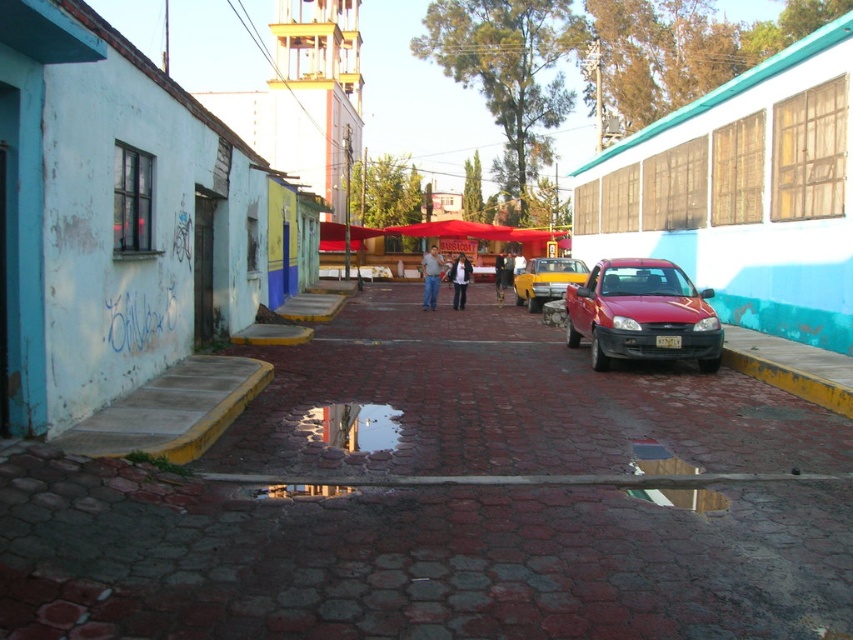
You are standing on the cobblestone street in the scene and want to cross to the building with light blue walls on the left. There is a glossy red car at center in your path. Can you safely walk around the car to reach the building without getting too close to the car?

The glossy red car at center is 35.06 feet away from you, so yes, you can safely walk around it to reach the building with light blue walls on the left while maintaining a comfortable distance.

You are a delivery person standing at the entrance of the building with light blue walls on the left. You need to deliver a package to a point marked by coordinates. Which of the two points, point (688, 355) or point (456, 278), is closer to you?

Point (688, 355) is closer to the viewer than point (456, 278), so the delivery person should go to point (688, 355) first as it is nearer.